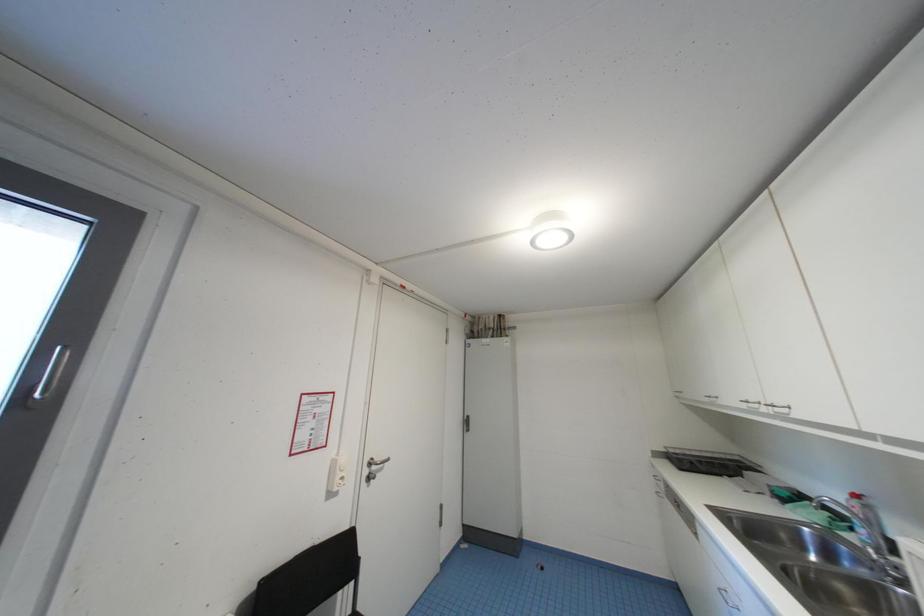
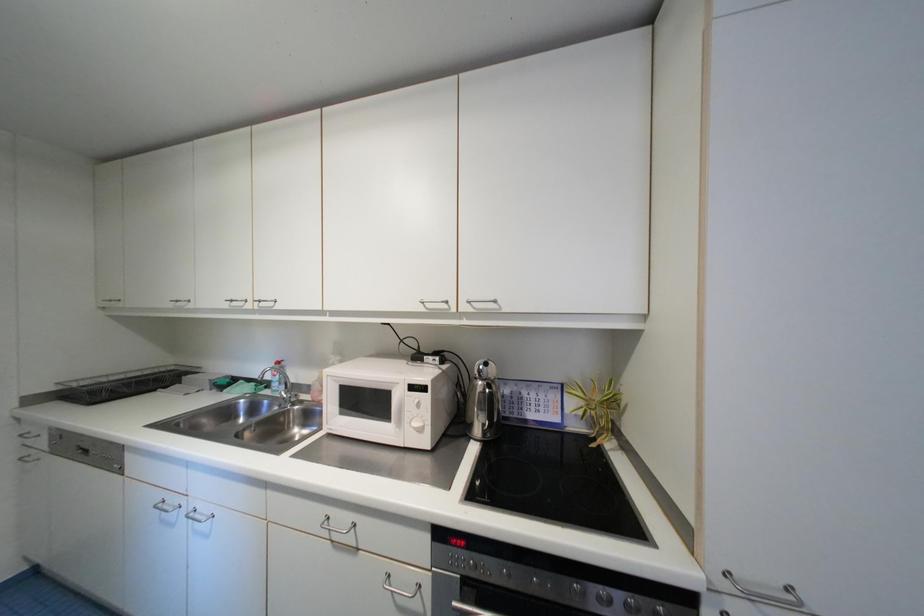
Question: The images are taken continuously from a first-person perspective. In which direction is your viewpoint rotating?

Choices:
 (A) Left
 (B) Right
 (C) Up
 (D) Down

Answer: (B)